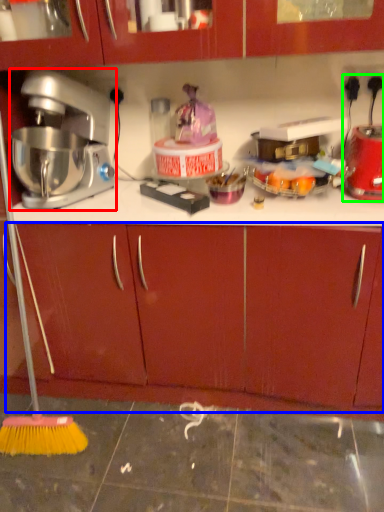
Question: Estimate the real-world distances between objects in this image. Which object is closer to mixer (highlighted by a red box), drawer (highlighted by a blue box) or blender (highlighted by a green box)?

Choices:
 (A) drawer
 (B) blender

Answer: (A)